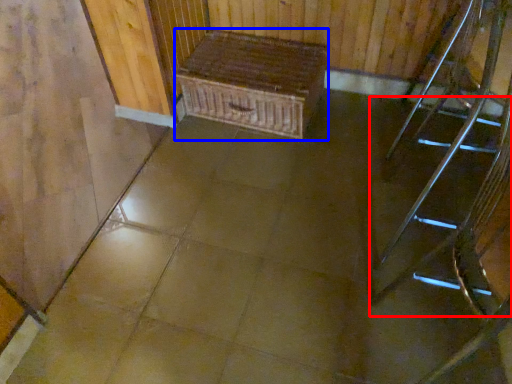
Question: Which of the following is the closest to the observer, stairs (highlighted by a red box) or furniture (highlighted by a blue box)?

Choices:
 (A) stairs
 (B) furniture

Answer: (A)